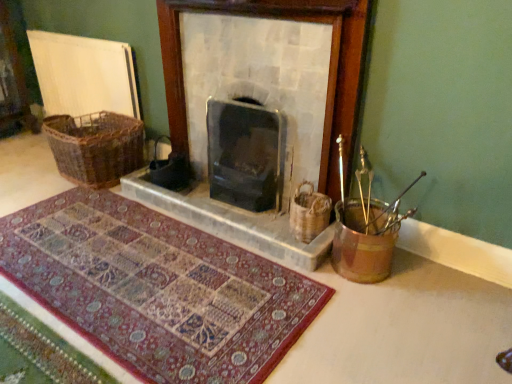
Find the location of a particular element. The width and height of the screenshot is (512, 384). free spot to the left of woven brown basket at left, marked as the second basket in a bottom-to-top arrangement is located at coordinates (29, 176).